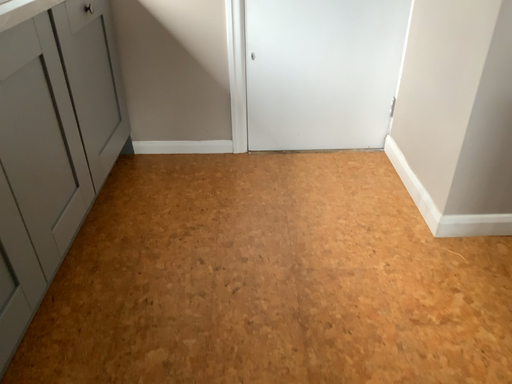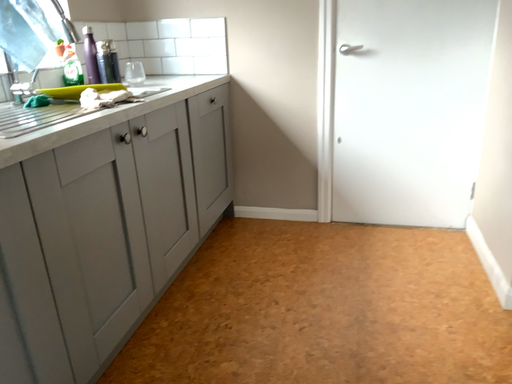
Question: How did the camera likely rotate when shooting the video?

Choices:
 (A) rotated upward
 (B) rotated downward

Answer: (A)